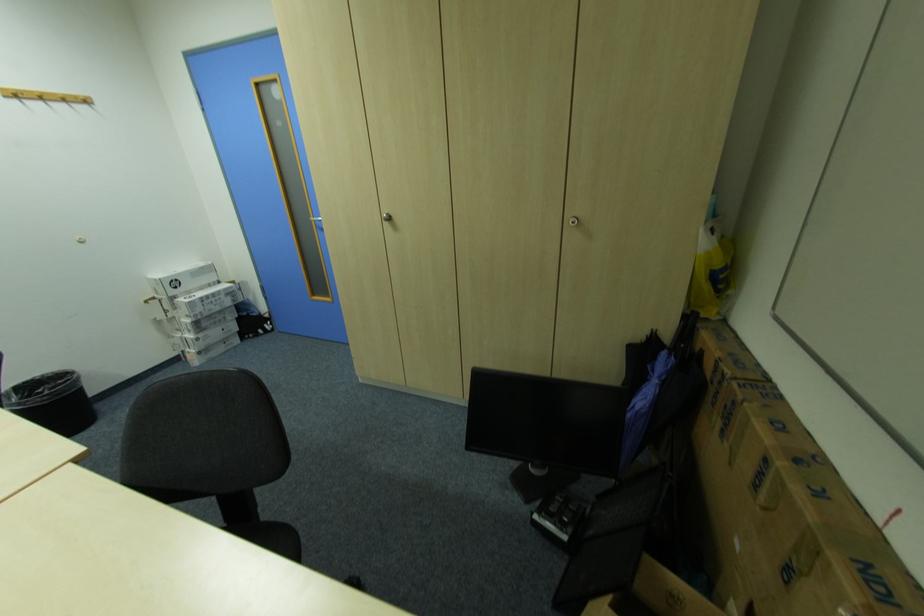
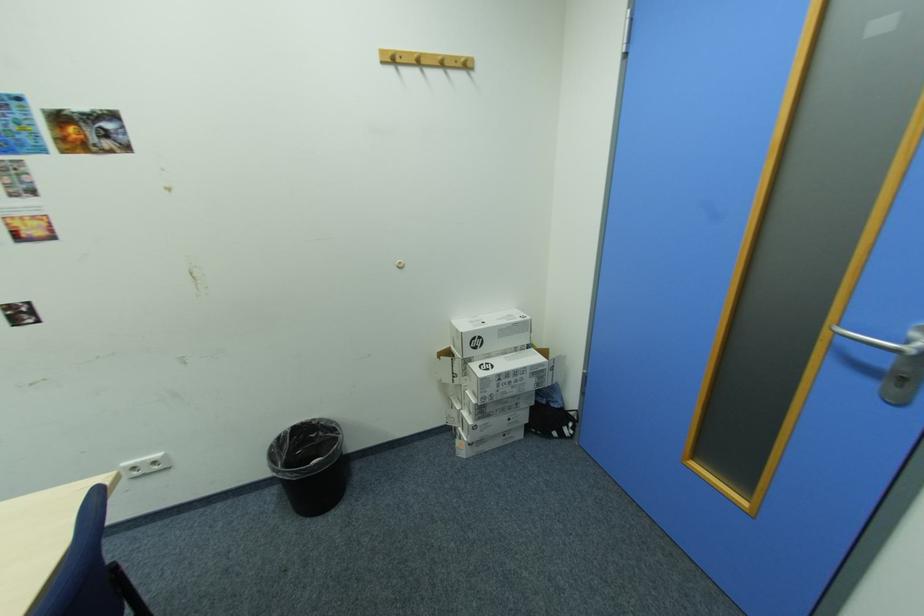
In the second image, find the point that corresponds to pixel 163 281 in the first image.

(465, 331)